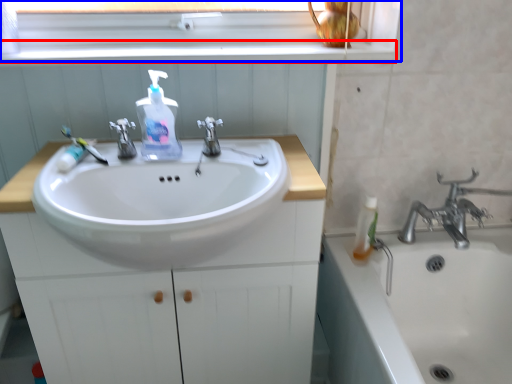
Question: Which of the following is the closest to the observer, window sill (highlighted by a red box) or window frame (highlighted by a blue box)?

Choices:
 (A) window sill
 (B) window frame

Answer: (A)